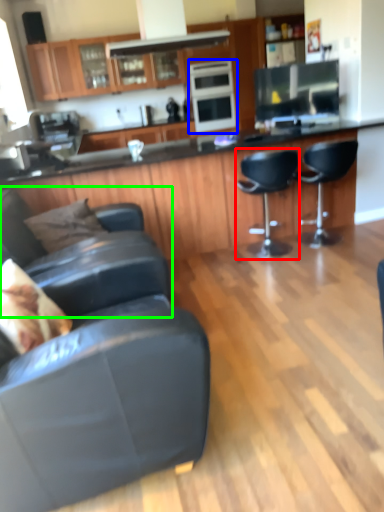
Question: Considering the real-world distances, which object is farthest from chair (highlighted by a red box)? appliance (highlighted by a blue box) or chair (highlighted by a green box)?

Choices:
 (A) appliance
 (B) chair

Answer: (B)